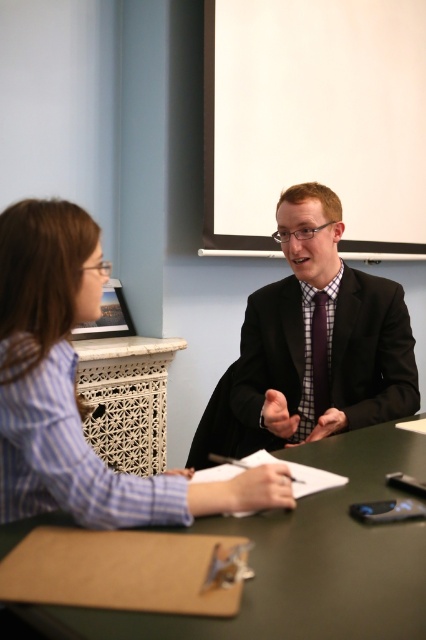
Question: Does green matte table at center come in front of matte black suit at center?

Choices:
 (A) no
 (B) yes

Answer: (B)

Question: Which point is closer to the camera?

Choices:
 (A) (43, 396)
 (B) (261, 324)

Answer: (A)

Question: Does green matte table at center have a larger size compared to purple satin tie at center?

Choices:
 (A) yes
 (B) no

Answer: (A)

Question: Which object is the farthest from the green matte table at center?

Choices:
 (A) matte black suit at center
 (B) blue striped shirt at left
 (C) purple satin tie at center

Answer: (C)

Question: Among these objects, which one is nearest to the camera?

Choices:
 (A) blue striped shirt at left
 (B) matte black suit at center
 (C) purple satin tie at center
 (D) green matte table at center

Answer: (D)

Question: Can you confirm if green matte table at center is smaller than purple satin tie at center?

Choices:
 (A) yes
 (B) no

Answer: (B)